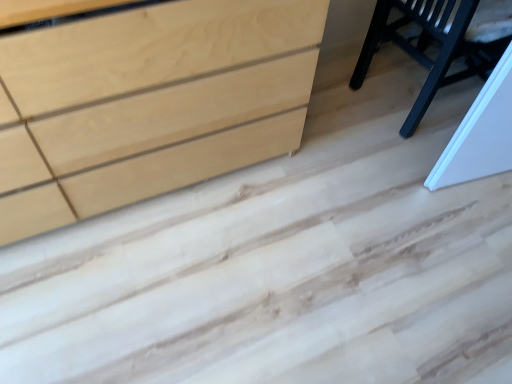
In order to click on free space in front of glossy black chair at upper right in this screenshot , I will do `click(429, 213)`.